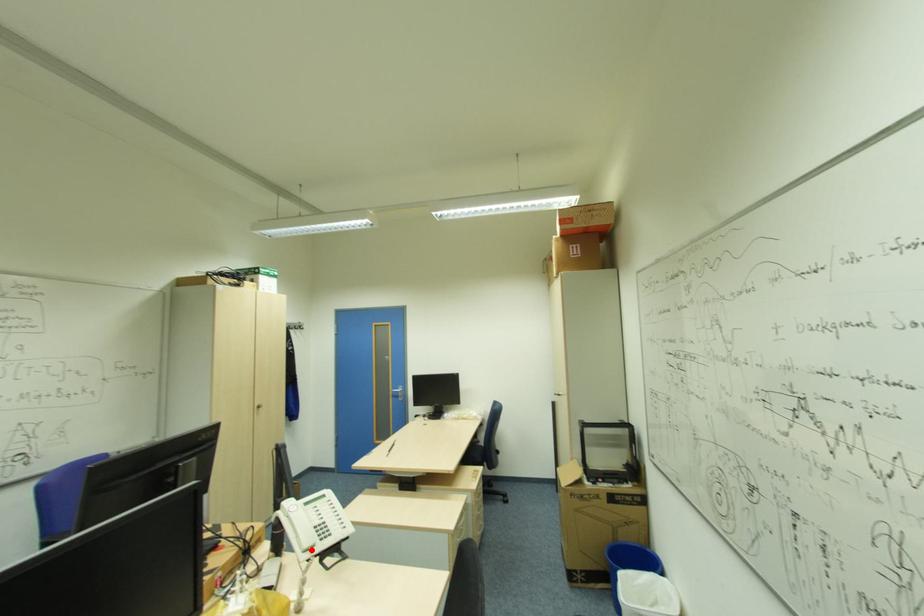
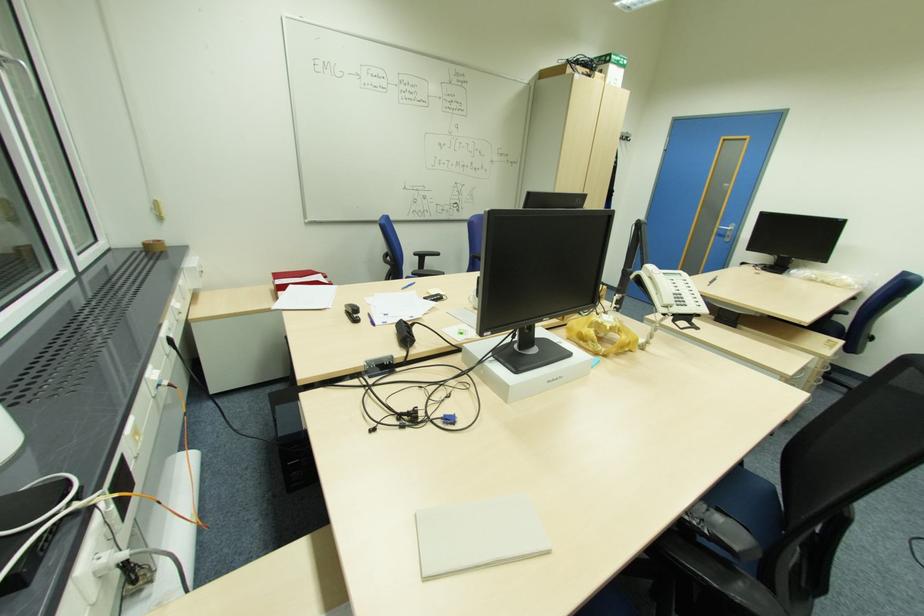
Locate, in the second image, the point that corresponds to the highlighted location in the first image.

(670, 306)